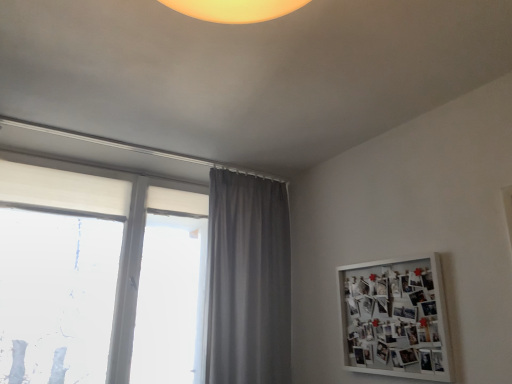
Question: Is white matte window at left to the left of white matte bulletin board at upper right from the viewer's perspective?

Choices:
 (A) yes
 (B) no

Answer: (A)

Question: Does white matte window at left lie in front of white matte bulletin board at upper right?

Choices:
 (A) yes
 (B) no

Answer: (B)

Question: Is white matte window at left oriented towards white matte bulletin board at upper right?

Choices:
 (A) yes
 (B) no

Answer: (B)

Question: Can you see white matte window at left touching white matte bulletin board at upper right?

Choices:
 (A) yes
 (B) no

Answer: (B)

Question: From the image's perspective, is white matte window at left above white matte bulletin board at upper right?

Choices:
 (A) no
 (B) yes

Answer: (B)

Question: Does point (209, 296) appear closer or farther from the camera than point (364, 286)?

Choices:
 (A) farther
 (B) closer

Answer: (A)

Question: Based on their sizes in the image, would you say gray fabric curtain at center is bigger or smaller than white matte bulletin board at upper right?

Choices:
 (A) big
 (B) small

Answer: (A)

Question: Considering their positions, is gray fabric curtain at center located in front of or behind white matte bulletin board at upper right?

Choices:
 (A) front
 (B) behind

Answer: (B)

Question: From a real-world perspective, is gray fabric curtain at center physically located above or below white matte bulletin board at upper right?

Choices:
 (A) below
 (B) above

Answer: (B)

Question: Relative to gray fabric curtain at center, is white matte window at left in front or behind?

Choices:
 (A) behind
 (B) front

Answer: (B)

Question: Would you say white matte window at left is inside or outside gray fabric curtain at center?

Choices:
 (A) outside
 (B) inside

Answer: (A)

Question: Considering the positions of white matte window at left and gray fabric curtain at center in the image, is white matte window at left taller or shorter than gray fabric curtain at center?

Choices:
 (A) short
 (B) tall

Answer: (B)

Question: Is white matte window at left bigger or smaller than gray fabric curtain at center?

Choices:
 (A) big
 (B) small

Answer: (A)

Question: Is gray fabric curtain at center wider or thinner than white matte window at left?

Choices:
 (A) thin
 (B) wide

Answer: (B)

Question: Would you say gray fabric curtain at center is to the left or to the right of white matte window at left in the picture?

Choices:
 (A) left
 (B) right

Answer: (B)